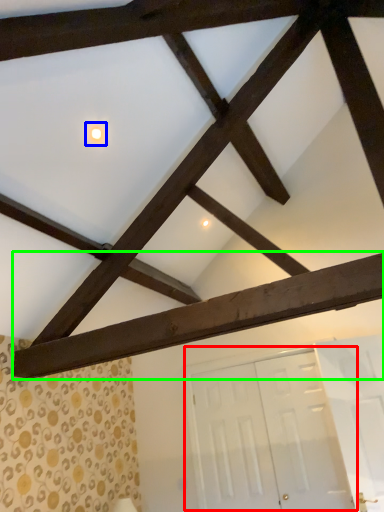
Question: Based on their relative distances, which object is nearer to door (highlighted by a red box)? Choose from light (highlighted by a blue box) and plank (highlighted by a green box).

Choices:
 (A) light
 (B) plank

Answer: (B)